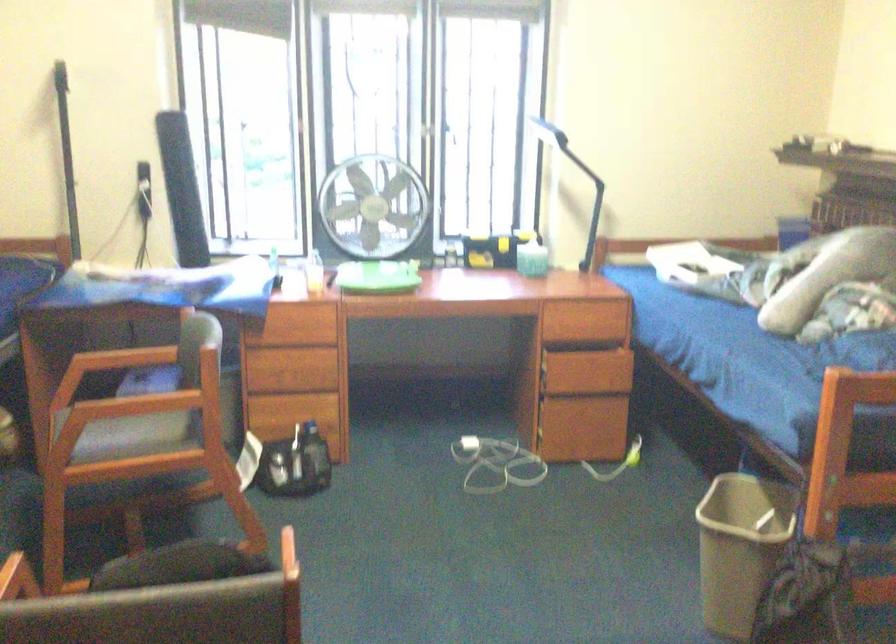
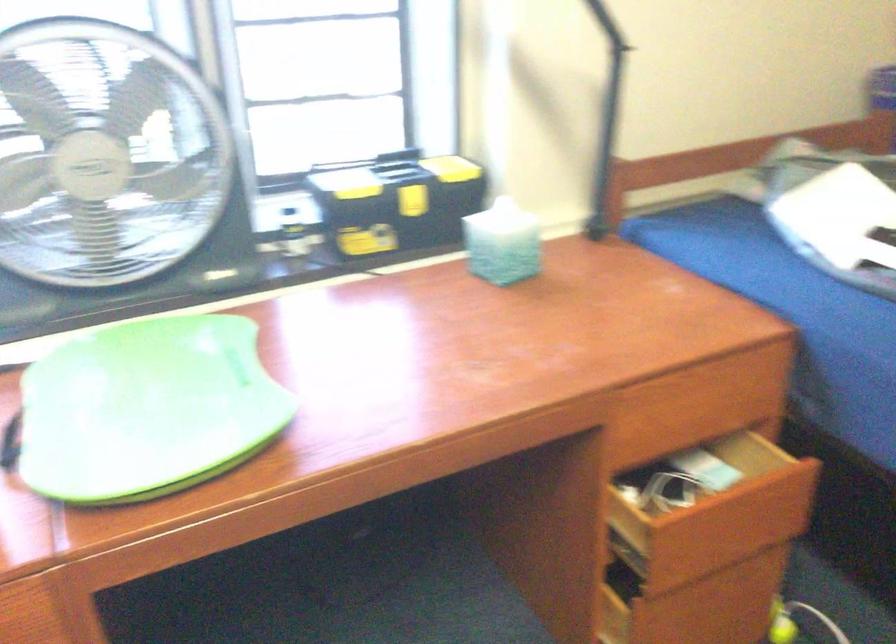
Question: I am providing you with two images of the same scene from different viewpoints. After the viewpoint changes to image2, which objects are now occluded?

Choices:
 (A) open drawer front
 (B) blue tissue box
 (C) closed drawer front
 (D) none of these

Answer: (D)